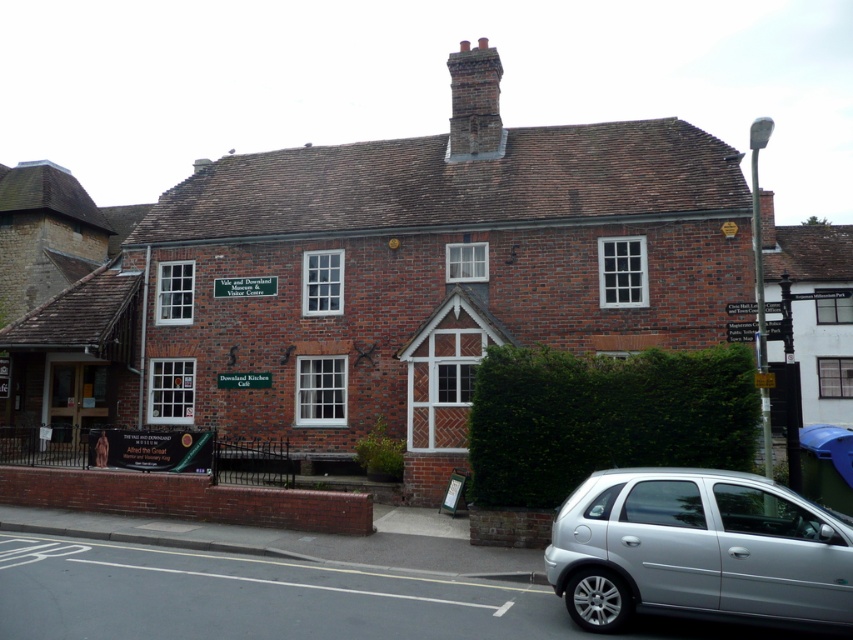
Does green leafy hedge at lower right have a greater height compared to brick chimney at upper center?

Incorrect, green leafy hedge at lower right's height is not larger of brick chimney at upper center's.

Which is above, green leafy hedge at lower right or brick chimney at upper center?

brick chimney at upper center is above.

Is point (532, 419) behind point (471, 83)?

That is False.

At what (x,y) coordinates should I click in order to perform the action: click on green leafy hedge at lower right. Please return your answer as a coordinate pair (x, y). The image size is (853, 640). Looking at the image, I should click on (596, 426).

Between point (682, 604) and point (577, 417), which one is positioned behind?

Point (577, 417)

Does silver metallic hatchback at lower right appear under green leafy hedge at lower right?

Yes, silver metallic hatchback at lower right is below green leafy hedge at lower right.

Does point (729, 556) lie in front of point (519, 449)?

Yes, point (729, 556) is closer to viewer.

Image resolution: width=853 pixels, height=640 pixels. Find the location of `silver metallic hatchback at lower right`. silver metallic hatchback at lower right is located at coordinates (698, 548).

Between silver metallic hatchback at lower right and brick chimney at upper center, which one has more height?

With more height is brick chimney at upper center.

Between silver metallic hatchback at lower right and brick chimney at upper center, which one is positioned lower?

silver metallic hatchback at lower right is lower down.

Does point (830, 560) come closer to viewer compared to point (453, 61)?

That is True.

Locate an element on the screen. The height and width of the screenshot is (640, 853). silver metallic hatchback at lower right is located at coordinates pos(698,548).